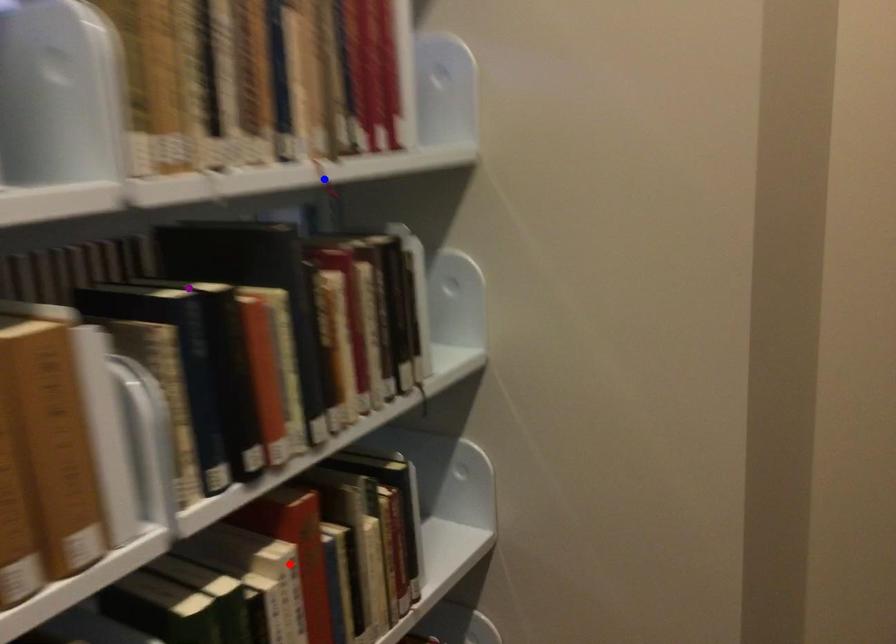
Consider the image. Order these from farthest to nearest:
blue point, red point, purple point

red point, blue point, purple point